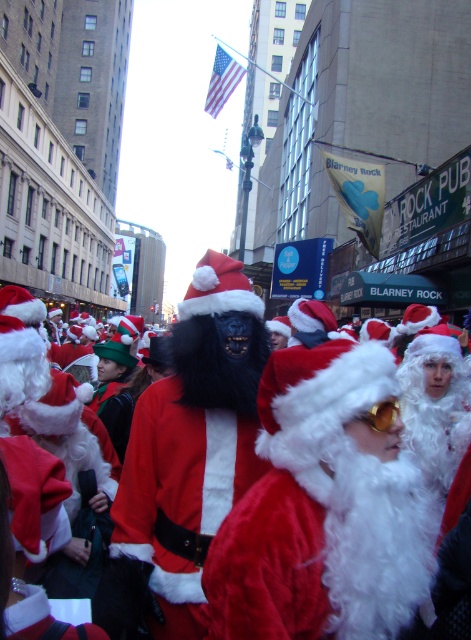
Question: Which object appears closest to the camera in this image?

Choices:
 (A) velvet red santa claus at center
 (B) velvet santa costume at center

Answer: (B)

Question: Considering the relative positions of velvet santa costume at center and velvet red santa claus at center in the image provided, where is velvet santa costume at center located with respect to velvet red santa claus at center?

Choices:
 (A) below
 (B) above

Answer: (B)

Question: Which of the following is the closest to the observer?

Choices:
 (A) click(309, 468)
 (B) click(235, 561)
 (C) click(132, 474)

Answer: (B)

Question: Does velvet santa costume at center appear over fuzzy red santa at center?

Choices:
 (A) no
 (B) yes

Answer: (B)

Question: Which object is closer to the camera taking this photo?

Choices:
 (A) fuzzy red santa at center
 (B) velvet red santa claus at center

Answer: (B)

Question: Can you confirm if velvet santa costume at center is thinner than fuzzy red santa at center?

Choices:
 (A) yes
 (B) no

Answer: (B)